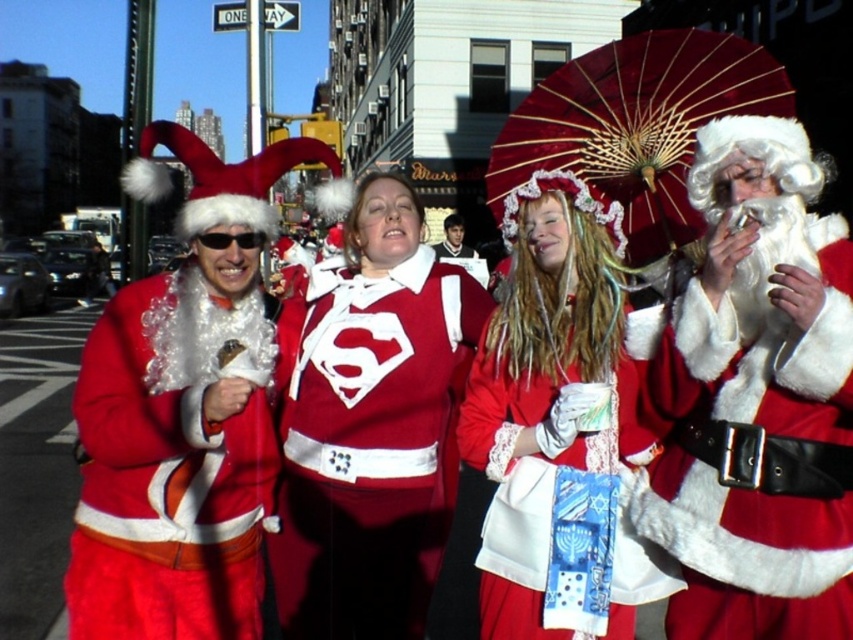
You are a photographer standing in the middle of the street, and you want to take a photo of both the velvet red umbrella at upper right and the smooth brown leather jacket at center. Which object should you adjust your camera to focus on first to ensure both are in the frame?

You should focus on the smooth brown leather jacket at center first because the velvet red umbrella at upper right is to the right of it, so adjusting the frame to include both would require starting from the left side where the jacket is located.